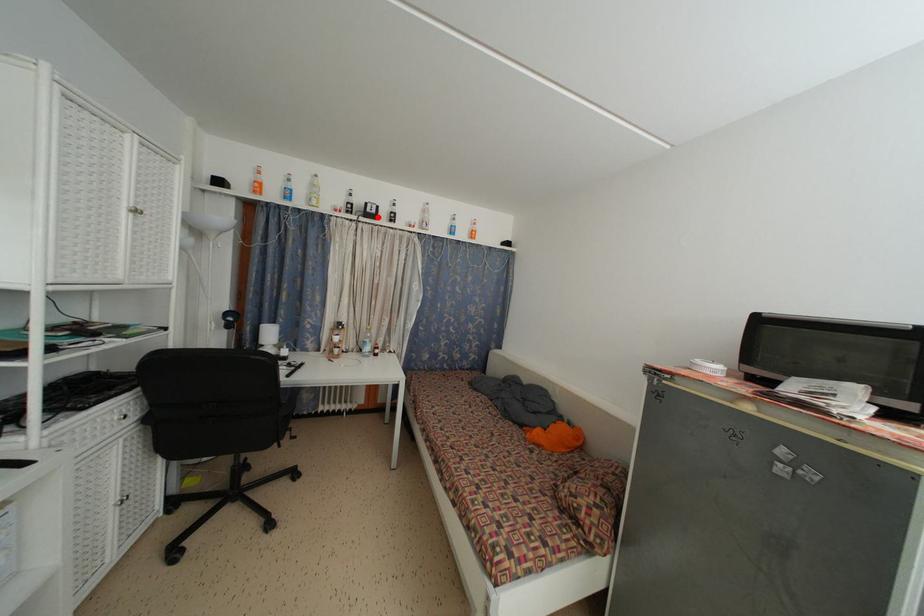
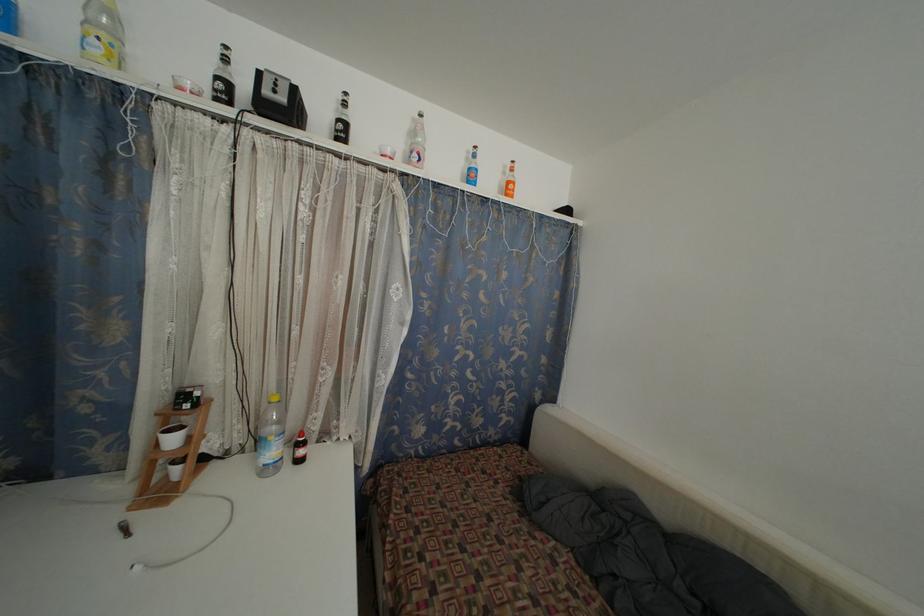
Where in the second image is the point corresponding to the highlighted location from the first image?

(286, 105)